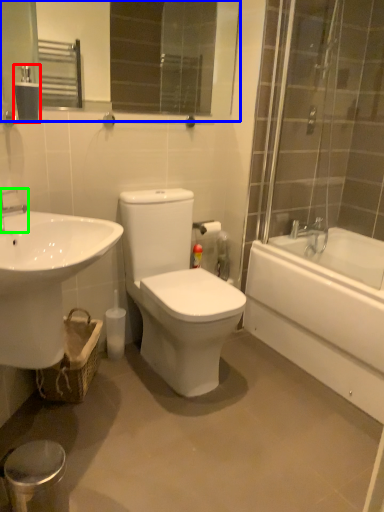
Question: Based on their relative distances, which object is farther from tissue (highlighted by a red box)? Choose from mirror (highlighted by a blue box) and tap (highlighted by a green box).

Choices:
 (A) mirror
 (B) tap

Answer: (A)